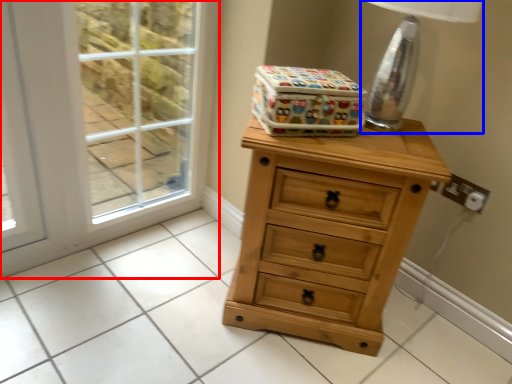
Question: Which object appears closest to the camera in this image, screen door (highlighted by a red box) or table lamp (highlighted by a blue box)?

Choices:
 (A) screen door
 (B) table lamp

Answer: (B)